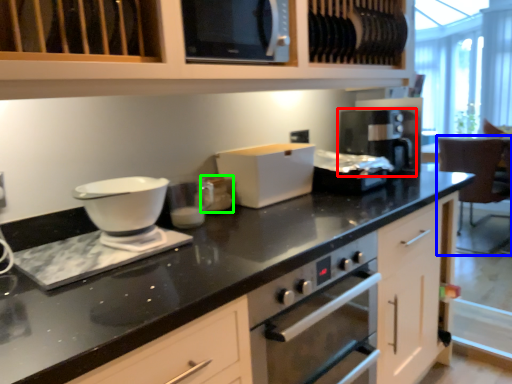
Question: Which object is the closest to the coffee machine (highlighted by a red box)? Choose among these: chair (highlighted by a blue box) or appliance (highlighted by a green box).

Choices:
 (A) chair
 (B) appliance

Answer: (B)